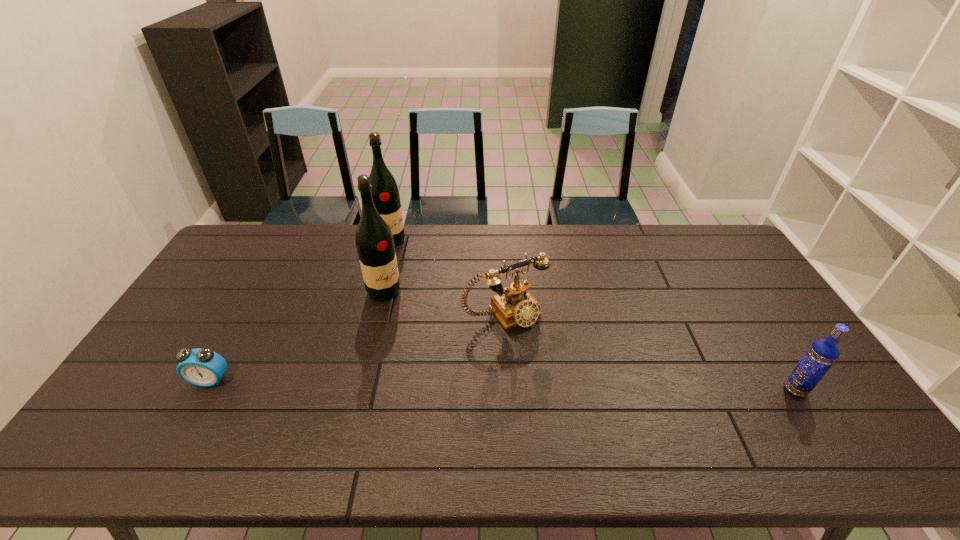
I want to click on object positioned at the left edge, so click(x=202, y=367).

Locate an element on the screen. object that is at the right edge is located at coordinates (822, 354).

Image resolution: width=960 pixels, height=540 pixels. Find the location of `object present at the near right corner`. object present at the near right corner is located at coordinates (x=822, y=354).

You are a GUI agent. You are given a task and a screenshot of the screen. Output one action in this format:
    pyautogui.click(x=<x>, y=<y>)
    Task: Click on the vacant space at the far edge
    This screenshot has width=960, height=540.
    Given the screenshot: What is the action you would take?
    pyautogui.click(x=484, y=262)

This screenshot has height=540, width=960. Identify the location of blank space at the near edge. (642, 399).

You are a GUI agent. You are given a task and a screenshot of the screen. Output one action in this format:
    pyautogui.click(x=<x>, y=<y>)
    Task: Click on the free space at the left edge of the desktop
    Image resolution: width=960 pixels, height=540 pixels.
    Given the screenshot: What is the action you would take?
    pyautogui.click(x=144, y=373)

In the image, there is a desktop. At what (x,y) coordinates should I click in order to perform the action: click on free space at the near right corner. Please return your answer as a coordinate pair (x, y). The width and height of the screenshot is (960, 540). Looking at the image, I should click on (790, 406).

The width and height of the screenshot is (960, 540). Identify the location of blank region between the leftmost object and the nearer liquor. (298, 336).

Find the location of `vacant area that lies between the shortest object and the vodka`. vacant area that lies between the shortest object and the vodka is located at coordinates (503, 385).

Where is `unoccupied area between the nearer liquor and the leftmost object`? The width and height of the screenshot is (960, 540). unoccupied area between the nearer liquor and the leftmost object is located at coordinates pos(298,336).